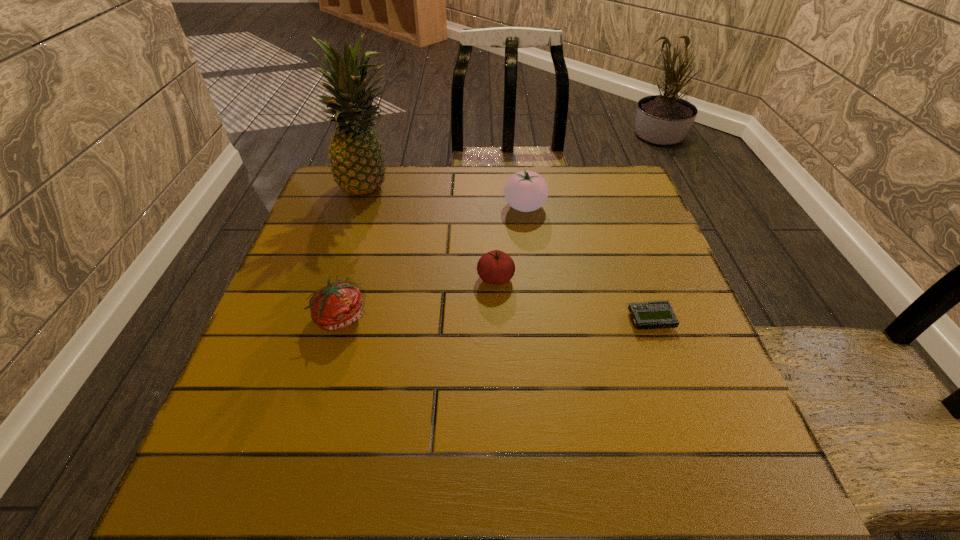
Where is `vacant area that lies between the second farthest tomato and the farthest tomato`? vacant area that lies between the second farthest tomato and the farthest tomato is located at coordinates (511, 242).

The width and height of the screenshot is (960, 540). What are the coordinates of `vacant area that lies between the pineapple and the beeper` in the screenshot? It's located at (511, 253).

Find the location of a particular element. This screenshot has width=960, height=540. unoccupied position between the third farthest object and the beeper is located at coordinates (573, 299).

Where is `free space that is in between the tallest object and the second nearest tomato`? free space that is in between the tallest object and the second nearest tomato is located at coordinates (433, 232).

Find the location of `object that is the fourth closest to the shortest object`. object that is the fourth closest to the shortest object is located at coordinates (357, 164).

Locate an element on the screen. object that ranks as the closest to the third nearest object is located at coordinates (526, 191).

Identify which tomato is located as the second nearest to the second tallest object. Please provide its 2D coordinates. Your answer should be formatted as a tuple, i.e. [(x, y)], where the tuple contains the x and y coordinates of a point satisfying the conditions above.

[(337, 306)]

Where is `tomato that is the closest to the leftmost tomato`? The width and height of the screenshot is (960, 540). tomato that is the closest to the leftmost tomato is located at coordinates (495, 267).

You are a GUI agent. You are given a task and a screenshot of the screen. Output one action in this format:
    pyautogui.click(x=<x>, y=<y>)
    Task: Click on the vacant position in the image that satisfies the following two spatial constraints: 1. on the front side of the rightmost object; 2. on the right side of the tallest object
    
    Given the screenshot: What is the action you would take?
    point(328,320)

Where is `free location that satisfies the following two spatial constraints: 1. on the front side of the beeper; 2. on the left side of the third nearest object`? free location that satisfies the following two spatial constraints: 1. on the front side of the beeper; 2. on the left side of the third nearest object is located at coordinates (497, 320).